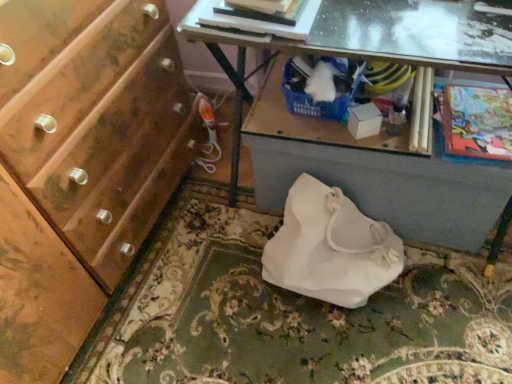
Image resolution: width=512 pixels, height=384 pixels. Identify the location of white cardboard box at center. (364, 121).

The image size is (512, 384). Describe the element at coordinates (330, 247) in the screenshot. I see `white fabric bag at center` at that location.

You are a GUI agent. You are given a task and a screenshot of the screen. Output one action in this format:
    pyautogui.click(x=<x>, y=<y>)
    Task: Click on the white fabric bag at center
    The height and width of the screenshot is (384, 512).
    Given the screenshot: What is the action you would take?
    pyautogui.click(x=330, y=247)

Locate an element on the screen. The height and width of the screenshot is (384, 512). white fabric bag at lower center is located at coordinates (289, 313).

Where is `wooden magazine at right, marked as the first magazine in a right-to-left arrangement`? wooden magazine at right, marked as the first magazine in a right-to-left arrangement is located at coordinates (421, 110).

What is the approximate height of matte black magazine at upper center, the 1th magazine when ordered from top to bottom?

matte black magazine at upper center, the 1th magazine when ordered from top to bottom, is 1.63 inches tall.

Where is `hardcover book at upper center`? This screenshot has width=512, height=384. hardcover book at upper center is located at coordinates (265, 22).

You are a GUI agent. You are given a task and a screenshot of the screen. Output one action in this format:
    pyautogui.click(x=<x>, y=<y>)
    Task: Click on the cartoon paper comic book at right
    The height and width of the screenshot is (384, 512).
    Given the screenshot: What is the action you would take?
    pyautogui.click(x=477, y=122)

At what (x,y) coordinates should I click in order to perform the action: click on white cardboard box at center. Please return your answer as a coordinate pair (x, y). Image resolution: width=512 pixels, height=384 pixels. Looking at the image, I should click on (364, 121).

Is white fabric bag at center placed right next to cartoon paper comic book at right?

white fabric bag at center and cartoon paper comic book at right are clearly separated.

From a real-world perspective, does white fabric bag at center sit lower than cartoon paper comic book at right?

Yes, from a real-world perspective, white fabric bag at center is below cartoon paper comic book at right.

Is cartoon paper comic book at right at the back of white fabric bag at center?

No, cartoon paper comic book at right is not at the back of white fabric bag at center.

Can you tell me how much white fabric bag at lower center and hardcover book at upper center differ in facing direction?

The angle between the facing direction of white fabric bag at lower center and the facing direction of hardcover book at upper center is 2.07 degrees.

Is white fabric bag at lower center outside of hardcover book at upper center?

Yes, white fabric bag at lower center is not within hardcover book at upper center.

Is hardcover book at upper center at the back of white fabric bag at lower center?

No, white fabric bag at lower center is not facing away from hardcover book at upper center.

In terms of width, does white fabric bag at lower center look wider or thinner when compared to hardcover book at upper center?

white fabric bag at lower center is wider than hardcover book at upper center.

You are a GUI agent. You are given a task and a screenshot of the screen. Output one action in this format:
    pyautogui.click(x=<x>, y=<y>)
    Task: Click on the desk behind the transparent glass table at upper center
    This screenshot has width=512, height=384.
    Given the screenshot: What is the action you would take?
    pyautogui.click(x=388, y=187)

Based on the photo, from the image's perspective, does white fabric bag at lower center appear higher than transparent glass table at upper center?

No, from the image's perspective, white fabric bag at lower center is not on top of transparent glass table at upper center.

From a real-world perspective, is white fabric bag at lower center under transparent glass table at upper center?

Indeed, from a real-world perspective, white fabric bag at lower center is positioned beneath transparent glass table at upper center.

Looking at this image, is white fabric bag at lower center beside transparent glass table at upper center?

No, white fabric bag at lower center is not making contact with transparent glass table at upper center.

Is white fabric bag at center thinner than white cardboard box at center?

No.

Is white fabric bag at center located outside white cardboard box at center?

Yes, white fabric bag at center is located beyond the bounds of white cardboard box at center.

Consider the image. Is white fabric bag at center at the right side of white cardboard box at center?

No, white fabric bag at center is not to the right of white cardboard box at center.

From a real-world perspective, which is physically below, matte black magazine at upper center, marked as the 2th magazine in a right-to-left arrangement, or cartoon paper comic book at right?

cartoon paper comic book at right, from a real-world perspective.

Is matte black magazine at upper center, positioned as the second magazine in bottom-to-top order, placed right next to cartoon paper comic book at right?

No, matte black magazine at upper center, positioned as the second magazine in bottom-to-top order, is not beside cartoon paper comic book at right.

Between matte black magazine at upper center, positioned as the second magazine in back-to-front order, and cartoon paper comic book at right, which one has smaller size?

Smaller between the two is matte black magazine at upper center, positioned as the second magazine in back-to-front order.

Who is taller, matte black magazine at upper center, positioned as the second magazine in back-to-front order, or cartoon paper comic book at right?

matte black magazine at upper center, positioned as the second magazine in back-to-front order, is taller.

Does point (474, 225) come behind point (460, 124)?

Yes, it is.

Can we say white fabric bag at lower center lies outside cartoon paper comic book at right?

Absolutely, white fabric bag at lower center is external to cartoon paper comic book at right.

What's the angular difference between white fabric bag at lower center and cartoon paper comic book at right's facing directions?

The angle between the facing direction of white fabric bag at lower center and the facing direction of cartoon paper comic book at right is 2.66 degrees.

From a real-world perspective, is transparent glass table at upper center physically located above or below matte black magazine at upper center, the 1th magazine when ordered from top to bottom?

In terms of real-world spatial position, transparent glass table at upper center is below matte black magazine at upper center, the 1th magazine when ordered from top to bottom.

Consider the image. Considering the sizes of objects transparent glass table at upper center and matte black magazine at upper center, the 1th magazine when ordered from top to bottom, in the image provided, who is bigger, transparent glass table at upper center or matte black magazine at upper center, the 1th magazine when ordered from top to bottom,?

transparent glass table at upper center is bigger.

Is transparent glass table at upper center positioned far away from matte black magazine at upper center, positioned as the second magazine in back-to-front order?

No, transparent glass table at upper center is in close proximity to matte black magazine at upper center, positioned as the second magazine in back-to-front order.

From the image's perspective, which is above, transparent glass table at upper center or matte black magazine at upper center, positioned as the second magazine in bottom-to-top order?

matte black magazine at upper center, positioned as the second magazine in bottom-to-top order, is shown above in the image.

Identify the location of handbag on the left of cartoon paper comic book at right. (330, 247).

In the image, there is a hardcover book at upper center. Where is `desk below it (from the image's perspective)`? The width and height of the screenshot is (512, 384). desk below it (from the image's perspective) is located at coordinates (388, 187).

Based on their spatial positions, is white fabric bag at center or transparent glass table at upper center further from matte black magazine at upper center, marked as the 2th magazine in a right-to-left arrangement?

Based on the image, white fabric bag at center appears to be further to matte black magazine at upper center, marked as the 2th magazine in a right-to-left arrangement.

Looking at the image, which one is located further to white cardboard box at center, wooden magazine at right, marked as the first magazine in a right-to-left arrangement, or white fabric bag at center?

white fabric bag at center lies further to white cardboard box at center than the other object.

Based on their spatial positions, is white fabric bag at center or hardcover book at upper center closer to cartoon paper comic book at right?

white fabric bag at center is positioned closer to the anchor cartoon paper comic book at right.

Looking at the image, which one is located closer to cartoon paper comic book at right, white fabric bag at center or matte black magazine at upper center, positioned as the second magazine in bottom-to-top order?

Based on the image, white fabric bag at center appears to be nearer to cartoon paper comic book at right.

From the image, which object appears to be farther from white fabric bag at lower center, matte black magazine at upper center, marked as the 1th magazine in a left-to-right arrangement, or white fabric bag at lower center?

Based on the image, matte black magazine at upper center, marked as the 1th magazine in a left-to-right arrangement, appears to be further to white fabric bag at lower center.

When comparing their distances from cartoon paper comic book at right, does transparent glass table at upper center or white fabric bag at lower center seem further?

transparent glass table at upper center is positioned further to the anchor cartoon paper comic book at right.

Considering their positions, is white fabric bag at lower center positioned further to cartoon paper comic book at right than transparent glass table at upper center?

transparent glass table at upper center is further to cartoon paper comic book at right.

Which object lies further to the anchor point white fabric bag at lower center, hardcover book at upper center or matte black magazine at upper center, marked as the 2th magazine in a right-to-left arrangement?

Based on the image, matte black magazine at upper center, marked as the 2th magazine in a right-to-left arrangement, appears to be further to white fabric bag at lower center.

Where is `box between transparent glass table at upper center and white fabric bag at lower center in the up-down direction`? The image size is (512, 384). box between transparent glass table at upper center and white fabric bag at lower center in the up-down direction is located at coordinates (364, 121).

Where is `glass table between matte black magazine at upper center, positioned as the second magazine in bottom-to-top order, and cartoon paper comic book at right from left to right`? The height and width of the screenshot is (384, 512). glass table between matte black magazine at upper center, positioned as the second magazine in bottom-to-top order, and cartoon paper comic book at right from left to right is located at coordinates pos(416,31).

At what (x,y) coordinates should I click in order to perform the action: click on magazine between transparent glass table at upper center and white fabric bag at center from top to bottom. Please return your answer as a coordinate pair (x, y). The image size is (512, 384). Looking at the image, I should click on (421, 110).

Identify the location of box between transparent glass table at upper center and white fabric bag at center in the up-down direction. This screenshot has height=384, width=512. (364, 121).